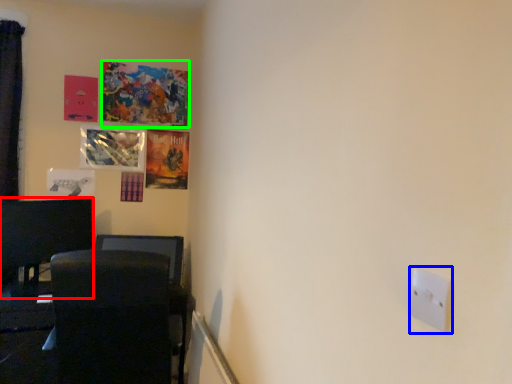
Question: Considering the real-world distances, which object is closest to furniture (highlighted by a red box)? light switch (highlighted by a blue box) or picture frame (highlighted by a green box).

Choices:
 (A) light switch
 (B) picture frame

Answer: (B)